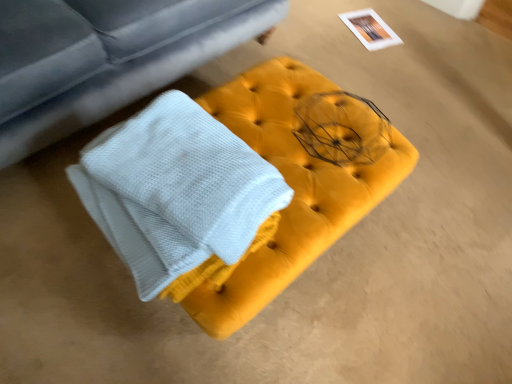
Question: Would you say velvet yellow ottoman at center is to the left or to the right of matte gray studio couch at upper left in the picture?

Choices:
 (A) left
 (B) right

Answer: (B)

Question: Considering the positions of velvet yellow ottoman at center and matte gray studio couch at upper left in the image, is velvet yellow ottoman at center wider or thinner than matte gray studio couch at upper left?

Choices:
 (A) wide
 (B) thin

Answer: (B)

Question: In terms of size, does velvet yellow ottoman at center appear bigger or smaller than matte gray studio couch at upper left?

Choices:
 (A) small
 (B) big

Answer: (A)

Question: Is matte gray studio couch at upper left taller or shorter than velvet yellow ottoman at center?

Choices:
 (A) short
 (B) tall

Answer: (B)

Question: From the image's perspective, is matte gray studio couch at upper left positioned above or below velvet yellow ottoman at center?

Choices:
 (A) below
 (B) above

Answer: (B)

Question: From a real-world perspective, is matte gray studio couch at upper left above or below velvet yellow ottoman at center?

Choices:
 (A) above
 (B) below

Answer: (A)

Question: Considering their positions, is matte gray studio couch at upper left located in front of or behind velvet yellow ottoman at center?

Choices:
 (A) behind
 (B) front

Answer: (B)